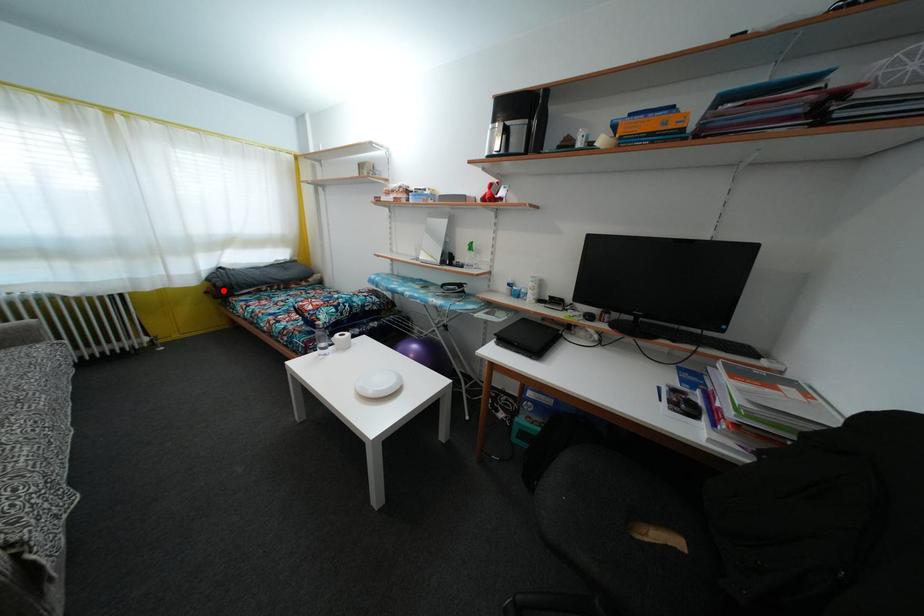
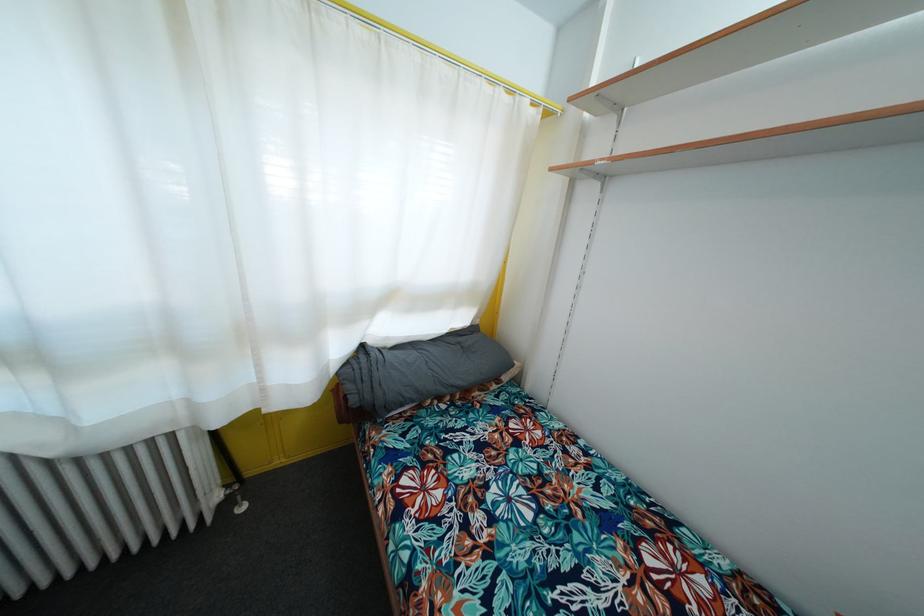
In the second image, find the point that corresponds to the highlighted location in the first image.

(358, 407)